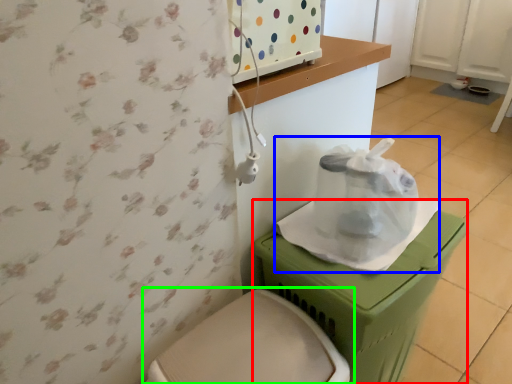
Question: Which is nearer to the potty (highlighted by a red box)? paper bag (highlighted by a blue box) or toilet (highlighted by a green box).

Choices:
 (A) paper bag
 (B) toilet

Answer: (A)